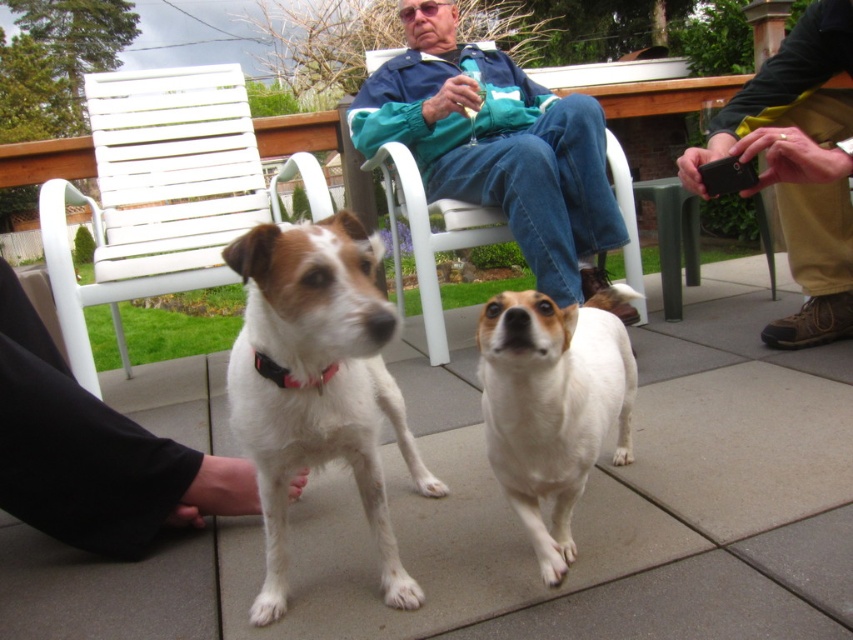
Who is higher up, white matte dog at center or white plastic chair at left?

white plastic chair at left is higher up.

Is white matte dog at center bigger than white plastic chair at left?

Actually, white matte dog at center might be smaller than white plastic chair at left.

Where is `white matte dog at center`? The height and width of the screenshot is (640, 853). white matte dog at center is located at coordinates (315, 387).

Locate an element on the screen. Image resolution: width=853 pixels, height=640 pixels. white matte dog at center is located at coordinates (315, 387).

Can you confirm if white matte dog at center is shorter than white fabric pants at lower left?

No, white matte dog at center is not shorter than white fabric pants at lower left.

Between white matte dog at center and white fabric pants at lower left, which one has less height?

With less height is white fabric pants at lower left.

Is point (323, 422) positioned after point (212, 499)?

No, it is not.

You are a GUI agent. You are given a task and a screenshot of the screen. Output one action in this format:
    pyautogui.click(x=<x>, y=<y>)
    Task: Click on the white matte dog at center
    
    Given the screenshot: What is the action you would take?
    pyautogui.click(x=315, y=387)

Which is above, white plastic chair at left or white fabric pants at lower left?

white plastic chair at left is above.

What do you see at coordinates (161, 195) in the screenshot?
I see `white plastic chair at left` at bounding box center [161, 195].

Find the location of `white plastic chair at left`. white plastic chair at left is located at coordinates (161, 195).